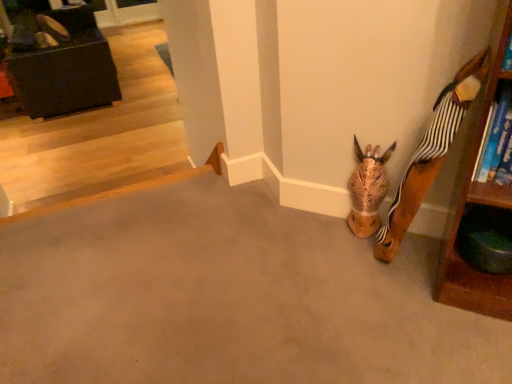
Question: Considering their positions, is matte brown shoe at upper left located in front of or behind matte black ottoman at upper left?

Choices:
 (A) behind
 (B) front

Answer: (A)

Question: Which is correct: matte brown shoe at upper left is inside matte black ottoman at upper left, or outside of it?

Choices:
 (A) inside
 (B) outside

Answer: (A)

Question: Estimate the real-world distances between objects in this image. Which object is farther from the brown textured animal head at lower right?

Choices:
 (A) brown matte concrete at lower right
 (B) wooden giraffe head at lower right
 (C) matte black ottoman at upper left
 (D) matte brown shoe at upper left

Answer: (D)

Question: Estimate the real-world distances between objects in this image. Which object is farther from the matte black ottoman at upper left?

Choices:
 (A) matte brown shoe at upper left
 (B) brown textured animal head at lower right
 (C) brown matte concrete at lower right
 (D) wooden giraffe head at lower right

Answer: (D)